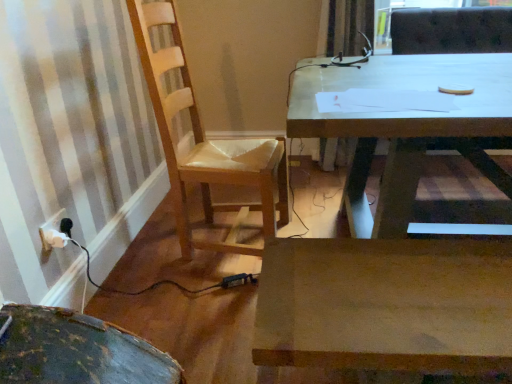
Question: Is wooden desk at center taller or shorter than wooden chair at left?

Choices:
 (A) short
 (B) tall

Answer: (A)

Question: From the image's perspective, is wooden desk at center above or below wooden chair at left?

Choices:
 (A) below
 (B) above

Answer: (A)

Question: Which is nearer to the wooden desk at center?

Choices:
 (A) white plastic electrical outlet at lower left
 (B) wooden chair at left

Answer: (B)

Question: Which is nearer to the white plastic electrical outlet at lower left?

Choices:
 (A) wooden desk at center
 (B) wooden chair at left

Answer: (B)